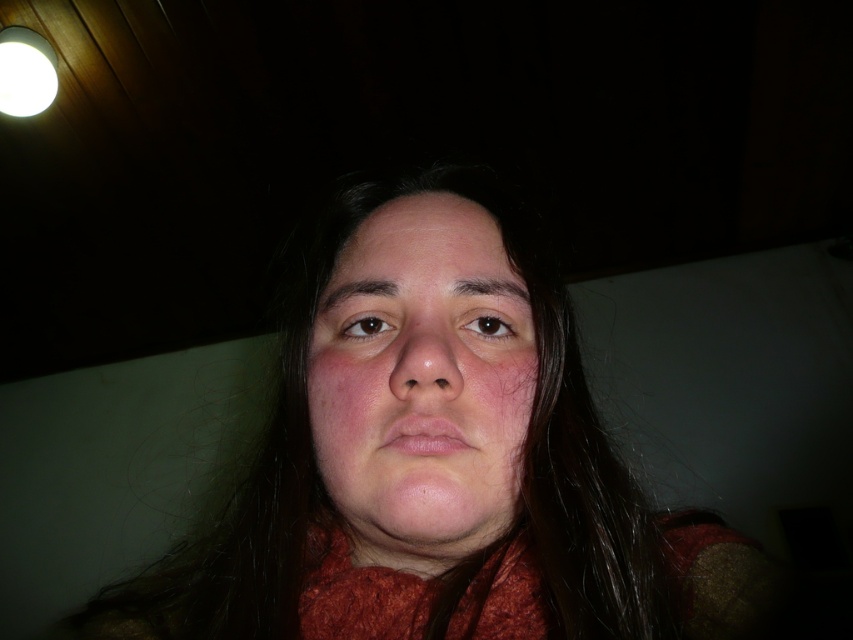
Can you confirm if matte orange scarf at center is positioned above smooth skin face at center?

Actually, matte orange scarf at center is below smooth skin face at center.

Which is above, matte orange scarf at center or smooth skin face at center?

Positioned higher is smooth skin face at center.

Measure the distance between point [705,586] and camera.

Point [705,586] and camera are 15.23 inches apart from each other.

The height and width of the screenshot is (640, 853). Identify the location of matte orange scarf at center. (434, 460).